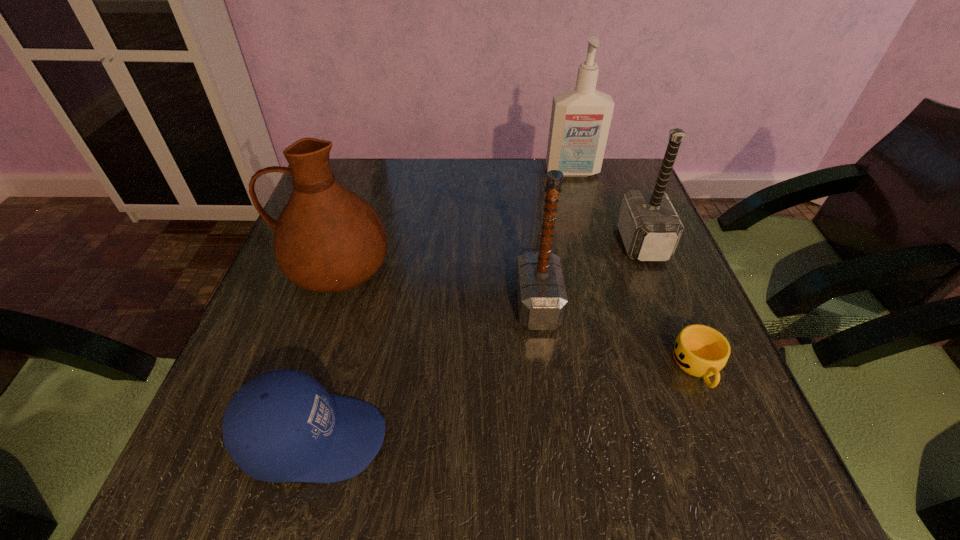
Find the location of a particular element. cleansing agent is located at coordinates (580, 121).

Identify the location of the fourth object from right to left. (541, 294).

Find the location of a particular element. The height and width of the screenshot is (540, 960). the nearer hammer is located at coordinates (541, 294).

This screenshot has height=540, width=960. I want to click on pitcher, so click(327, 239).

Where is `the right hammer`? the right hammer is located at coordinates (650, 228).

In order to click on cap in this screenshot , I will do point(282,426).

This screenshot has height=540, width=960. Identify the location of the nearest object. tap(282, 426).

The width and height of the screenshot is (960, 540). I want to click on the shortest object, so click(699, 350).

You are a GUI agent. You are given a task and a screenshot of the screen. Output one action in this format:
    pyautogui.click(x=<x>, y=<y>)
    Task: Click on the second nearest object
    
    Given the screenshot: What is the action you would take?
    pyautogui.click(x=699, y=350)

Find the location of a particular element. vacant area located on the front label of the cleansing agent is located at coordinates (590, 239).